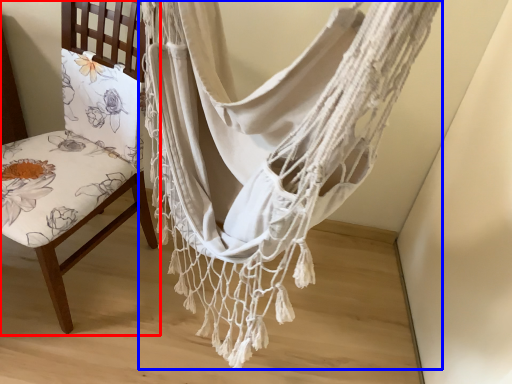
Question: Which object is closer to the camera taking this photo, chair (highlighted by a red box) or curtain (highlighted by a blue box)?

Choices:
 (A) chair
 (B) curtain

Answer: (B)